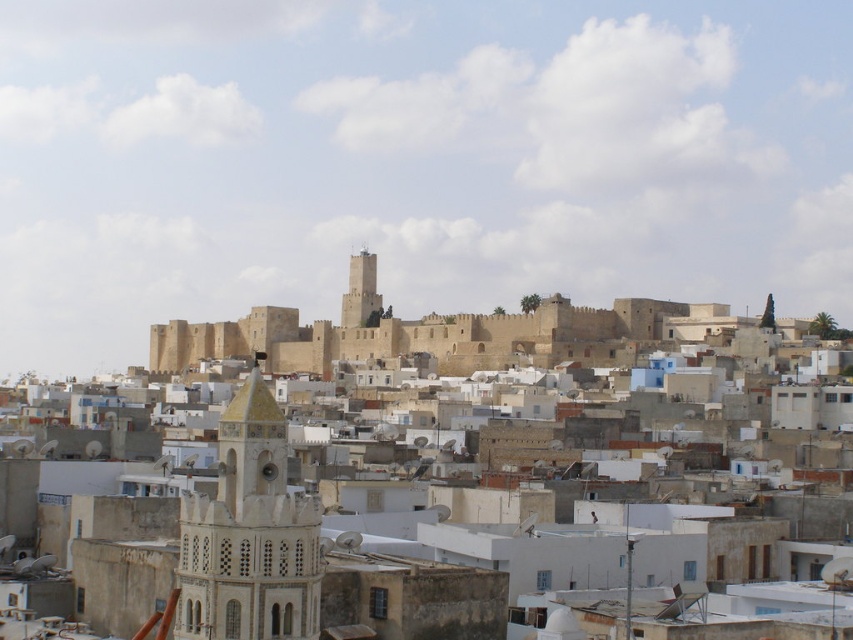
Question: Does beige stone town at center appear over white stucco tower at center?

Choices:
 (A) no
 (B) yes

Answer: (B)

Question: Which point is farther from the camera taking this photo?

Choices:
 (A) (x=369, y=292)
 (B) (x=239, y=566)

Answer: (A)

Question: Among these objects, which one is nearest to the camera?

Choices:
 (A) white stucco tower at center
 (B) light brown stone tower at center
 (C) beige stone town at center

Answer: (A)

Question: Which of the following is the farthest from the observer?

Choices:
 (A) (155, 502)
 (B) (341, 316)
 (C) (300, 589)

Answer: (B)

Question: Can you confirm if white stucco tower at center is thinner than light brown stone tower at center?

Choices:
 (A) no
 (B) yes

Answer: (A)

Question: Is beige stone town at center further to camera compared to white stucco tower at center?

Choices:
 (A) no
 (B) yes

Answer: (B)